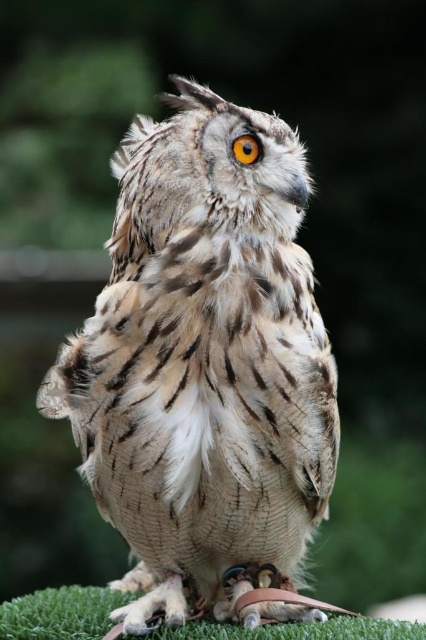
You are an animal trainer observing an owl in an educational setup. You notice the brown feathered owl at center and the green artificial turf at lower center. Which object is positioned more to the right side of the scene?

The brown feathered owl at center is positioned more to the right of the green artificial turf at lower center according to the description.

You are a bird trainer observing an owl in an educational setup. You need to place a treat for the owl. The treat must be placed on the green artificial turf at lower center. Given that the coordinate system starts at the bottom left corner of the image, with x and y ranging from 0 to 1, can you confirm if the point at coordinates point (58, 612) is the correct location for placing the treat?

Yes, the point (58, 612) marks the green artificial turf at lower center, so placing the treat there is correct.

You are a photographer trying to capture a clear shot of the orange fur eye at center. However, you notice the green artificial turf at lower center is blocking your view. Can you adjust your position to get a better angle without moving the owl?

The green artificial turf at lower center is closer to the viewer than the orange fur eye at center, so moving your camera position slightly upwards or backwards might allow you to avoid the obstruction while still capturing the orange fur eye at center clearly.